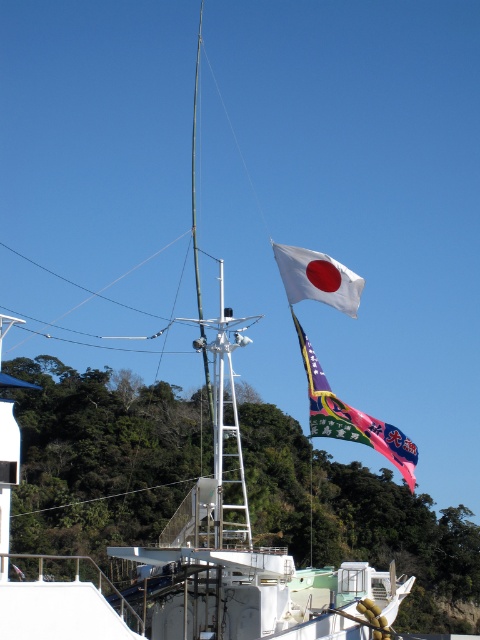
Question: Which point is closer to the camera?

Choices:
 (A) white fabric flag at upper right
 (B) white fabric flag at upper center

Answer: (A)

Question: Which object is farther from the camera taking this photo?

Choices:
 (A) white fabric flag at upper right
 (B) white fabric flag at upper center

Answer: (B)

Question: Is white fabric flag at upper right wider than white fabric flag at upper center?

Choices:
 (A) yes
 (B) no

Answer: (A)

Question: Which of the following is the farthest from the observer?

Choices:
 (A) (275, 253)
 (B) (369, 429)

Answer: (A)

Question: Is white fabric flag at upper right to the right of white fabric flag at upper center from the viewer's perspective?

Choices:
 (A) yes
 (B) no

Answer: (A)

Question: Is white fabric flag at upper right above white fabric flag at upper center?

Choices:
 (A) yes
 (B) no

Answer: (B)